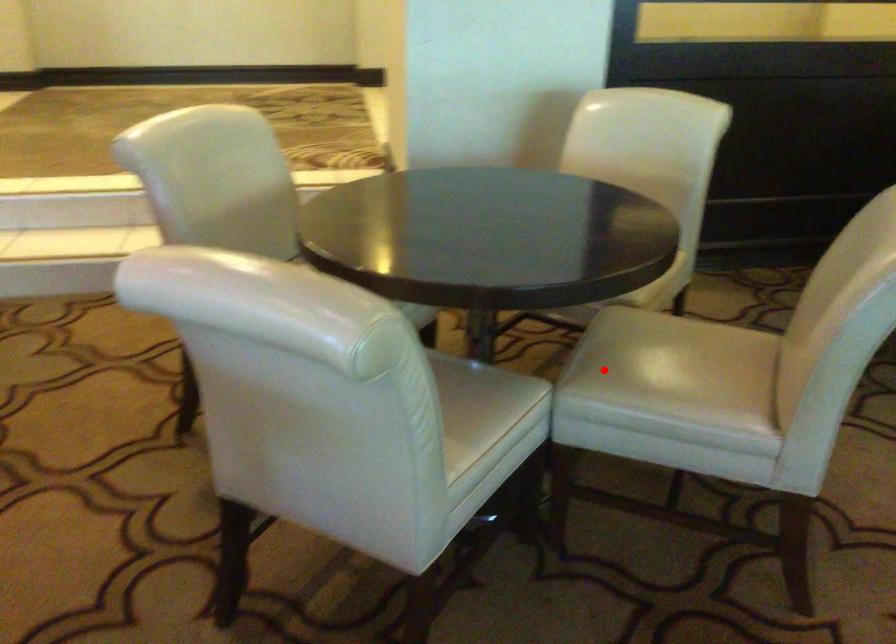
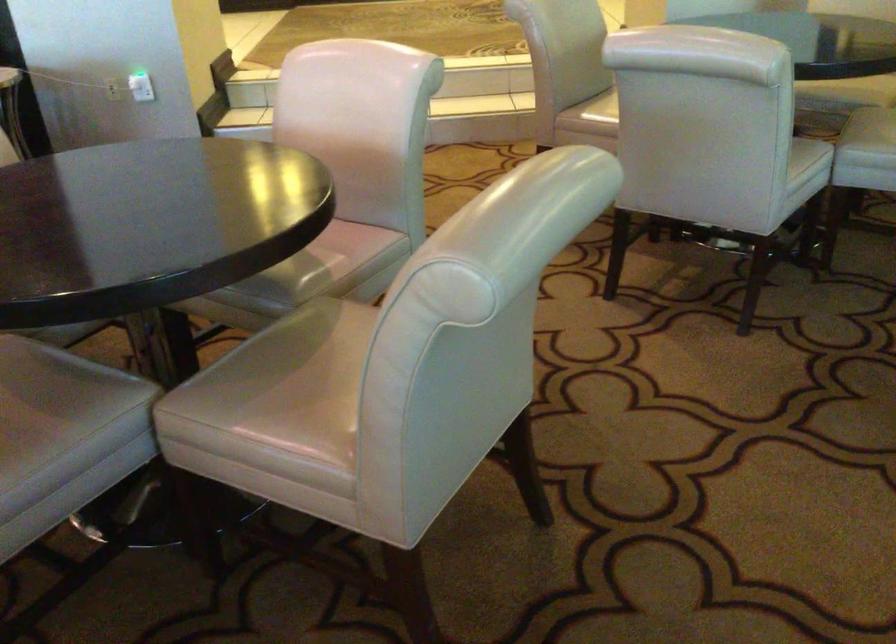
Question: I am providing you with two images of the same scene from different viewpoints. Given a red point in image1, look at the same physical point in image2. Is it:

Choices:
 (A) Closer to the viewpoint
 (B) Farther from the viewpoint

Answer: (B)